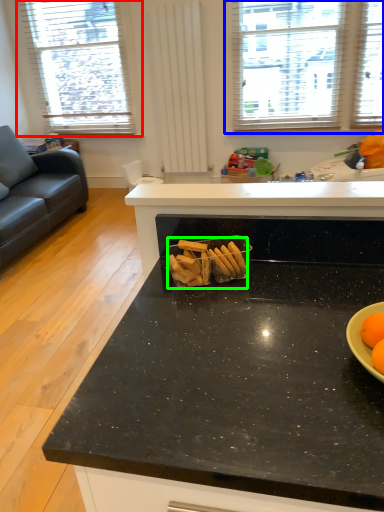
Question: Considering the real-world distances, which object is farthest from window (highlighted by a red box)? window (highlighted by a blue box) or snack (highlighted by a green box)?

Choices:
 (A) window
 (B) snack

Answer: (B)